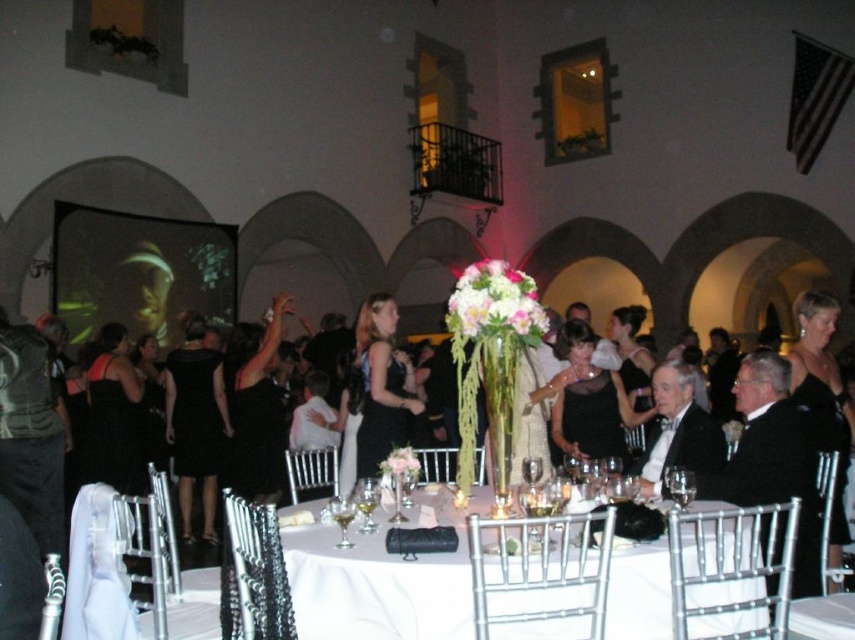
Between black satin dress at center and white silk bouquet at center, which one appears on the left side from the viewer's perspective?

Positioned to the left is black satin dress at center.

Is the position of black satin dress at center less distant than that of white silk bouquet at center?

No.

Is point (360, 472) behind point (488, 308)?

Yes, it is behind point (488, 308).

Find the location of a particular element. black satin dress at center is located at coordinates (382, 385).

Can you confirm if pale pink silk flower at center is smaller than clear glass wine glass at center?

Incorrect, pale pink silk flower at center is not smaller in size than clear glass wine glass at center.

You are a GUI agent. You are given a task and a screenshot of the screen. Output one action in this format:
    pyautogui.click(x=<x>, y=<y>)
    Task: Click on the pale pink silk flower at center
    The image size is (855, 640).
    Given the screenshot: What is the action you would take?
    pyautogui.click(x=399, y=461)

Is the position of white silk bouquet at center less distant than that of clear glass wine glass at center?

No.

Is white silk bouquet at center smaller than clear glass wine glass at center?

Actually, white silk bouquet at center might be larger than clear glass wine glass at center.

Find the location of a particular element. white silk bouquet at center is located at coordinates (494, 304).